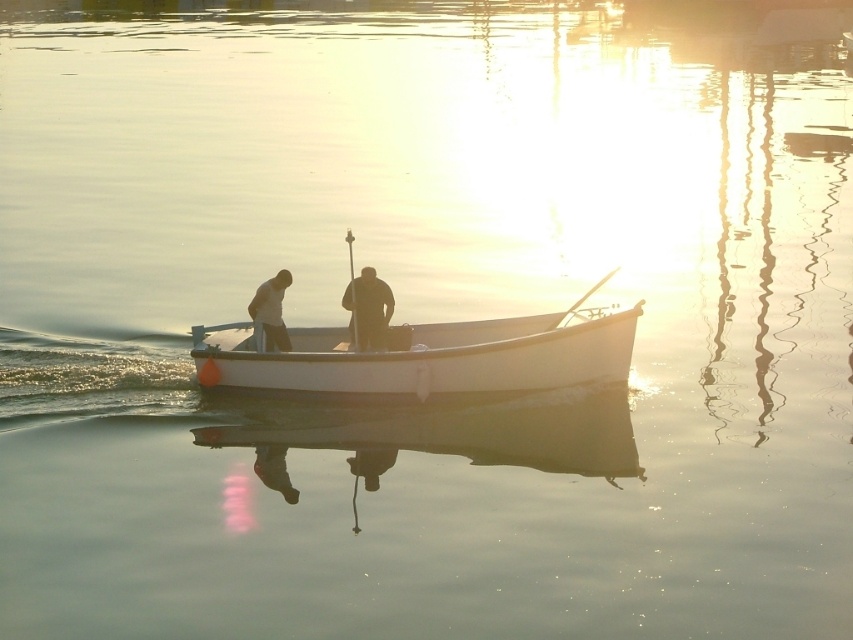
Does white matte canoe at center appear under smooth white shirt at center?

Yes.

Is white matte canoe at center wider than smooth white shirt at center?

Indeed, white matte canoe at center has a greater width compared to smooth white shirt at center.

You are a GUI agent. You are given a task and a screenshot of the screen. Output one action in this format:
    pyautogui.click(x=<x>, y=<y>)
    Task: Click on the white matte canoe at center
    The width and height of the screenshot is (853, 640).
    Given the screenshot: What is the action you would take?
    pyautogui.click(x=431, y=356)

Who is positioned more to the left, white matte canoe at center or dark brown leather jacket at center?

dark brown leather jacket at center

Who is higher up, white matte canoe at center or dark brown leather jacket at center?

Positioned higher is dark brown leather jacket at center.

The image size is (853, 640). In order to click on white matte canoe at center in this screenshot , I will do `click(431, 356)`.

Who is positioned more to the right, dark brown leather jacket at center or smooth white shirt at center?

From the viewer's perspective, dark brown leather jacket at center appears more on the right side.

Is dark brown leather jacket at center positioned at the back of smooth white shirt at center?

No, it is in front of smooth white shirt at center.

Locate an element on the screen. Image resolution: width=853 pixels, height=640 pixels. dark brown leather jacket at center is located at coordinates (368, 308).